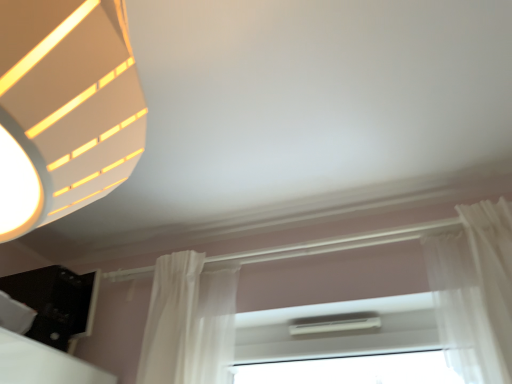
Find the location of `white matte lampshade at upper left`. white matte lampshade at upper left is located at coordinates [65, 109].

The image size is (512, 384). Describe the element at coordinates (65, 109) in the screenshot. I see `white matte lampshade at upper left` at that location.

Find the location of a particular element. white matte lampshade at upper left is located at coordinates (65, 109).